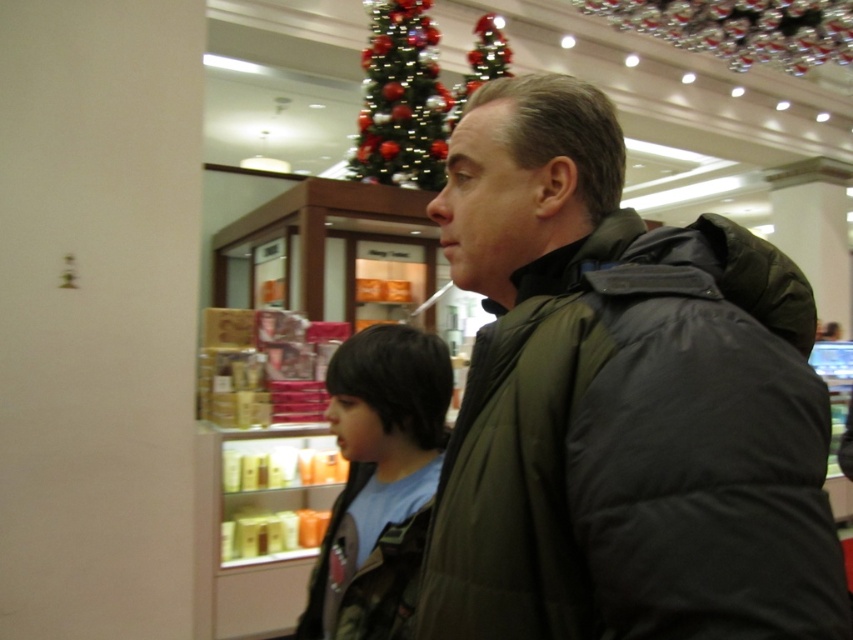
Who is positioned more to the right, dark green puffer jacket at center or camouflage jacket at center?

dark green puffer jacket at center is more to the right.

Does dark green puffer jacket at center appear on the right side of camouflage jacket at center?

Indeed, dark green puffer jacket at center is positioned on the right side of camouflage jacket at center.

Is point (577, 257) positioned behind point (357, 520)?

No, (577, 257) is closer to viewer.

At what (x,y) coordinates should I click in order to perform the action: click on dark green puffer jacket at center. Please return your answer as a coordinate pair (x, y). Image resolution: width=853 pixels, height=640 pixels. Looking at the image, I should click on (619, 404).

Can you confirm if dark green puffer jacket at center is positioned above shiny metallic tree at upper center?

Incorrect, dark green puffer jacket at center is not positioned above shiny metallic tree at upper center.

Does point (543, 428) come farther from viewer compared to point (419, 3)?

No, (543, 428) is closer to viewer.

In order to click on dark green puffer jacket at center in this screenshot , I will do `click(619, 404)`.

How distant is camouflage jacket at center from shiny metallic tree at upper center?

camouflage jacket at center and shiny metallic tree at upper center are 11.86 feet apart.

Between point (398, 576) and point (412, 131), which one is positioned behind?

The point (412, 131) is more distant.

Is point (335, 506) positioned after point (392, 160)?

No, it is in front of (392, 160).

Image resolution: width=853 pixels, height=640 pixels. Identify the location of camouflage jacket at center. (379, 481).